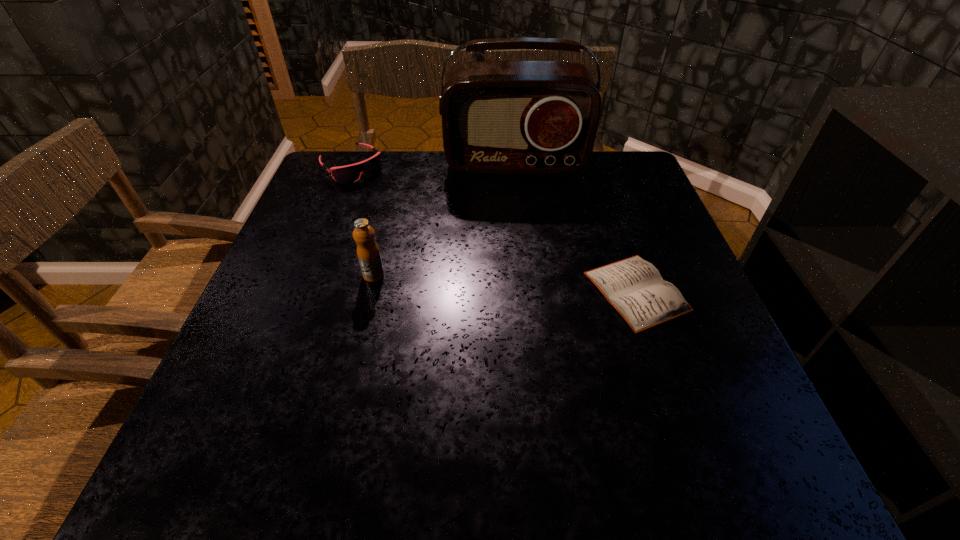
You are a GUI agent. You are given a task and a screenshot of the screen. Output one action in this format:
    pyautogui.click(x=<x>, y=<y>)
    Task: Click on the free space on the desktop that is between the third shortest object and the diary and is positioned on the front panel of the radio receiver
    
    Given the screenshot: What is the action you would take?
    pyautogui.click(x=526, y=285)

This screenshot has width=960, height=540. I want to click on free space on the desktop that is between the orange juice and the shortest object and is positioned on the front-facing side of the third tallest object, so click(468, 281).